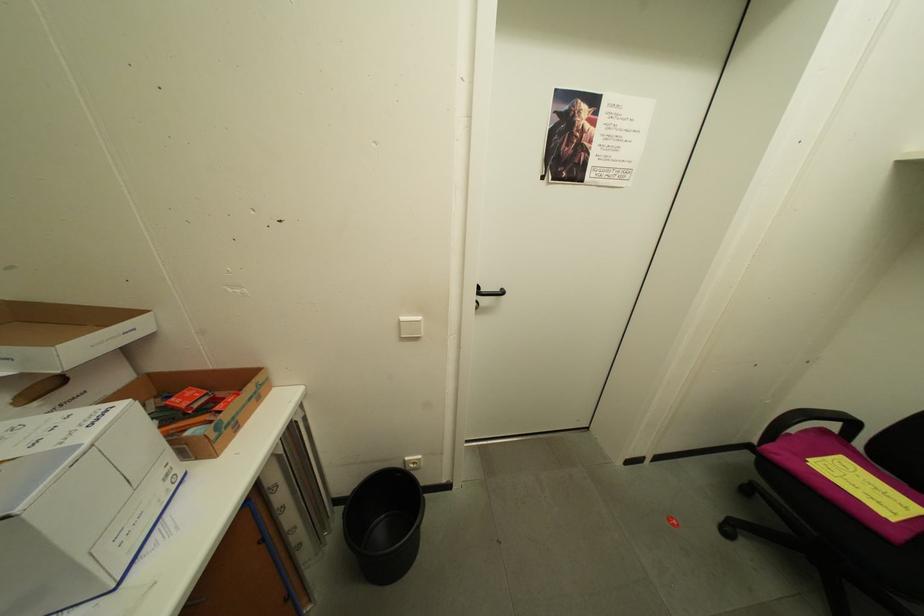
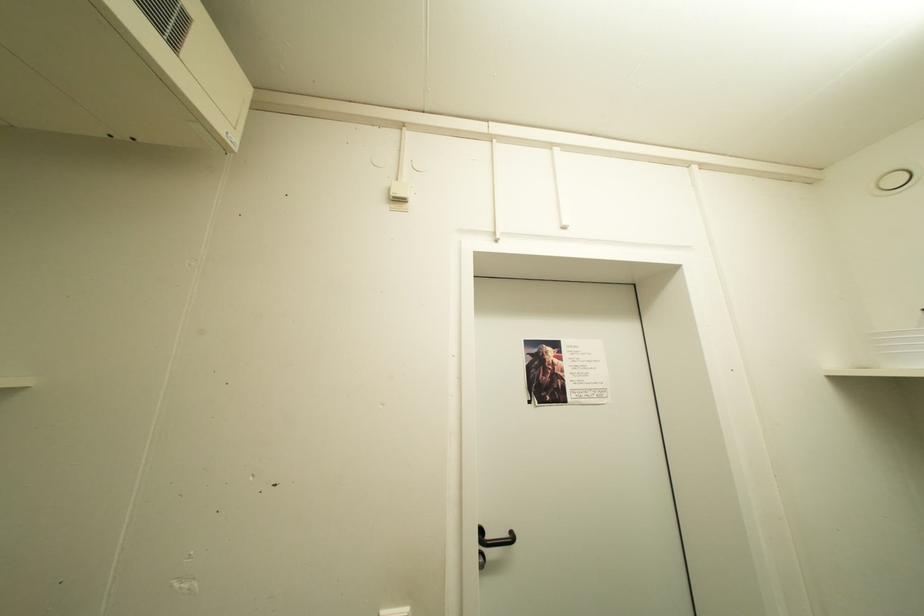
Question: The first image is from the beginning of the video and the second image is from the end. How did the camera likely rotate when shooting the video?

Choices:
 (A) Left
 (B) Right
 (C) Up
 (D) Down

Answer: (C)